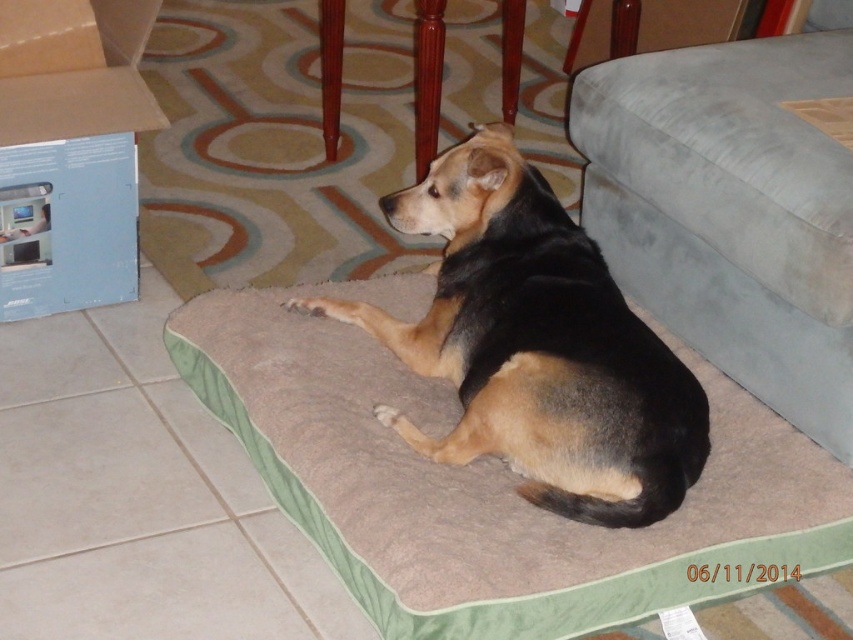
You are taking a photo of the dog bed and the blue box. The dog bed is at point (376, 458) and the blue box is at point (77, 192). Which object will appear larger in your photo?

Point (376, 458) is closer to the camera than point (77, 192), so the dog bed at point (376, 458) will appear larger in the photo.

You are a dog owner who wants to place a new toy on the floor next to the brown fur dog at center. Based on the scene, which side of the dog should you place the toy to ensure it is also near the beige soft dog bed at center?

The beige soft dog bed at center is to the right of the brown fur dog at center. Therefore, placing the toy to the right side of the brown fur dog at center would position it near the beige soft dog bed at center.